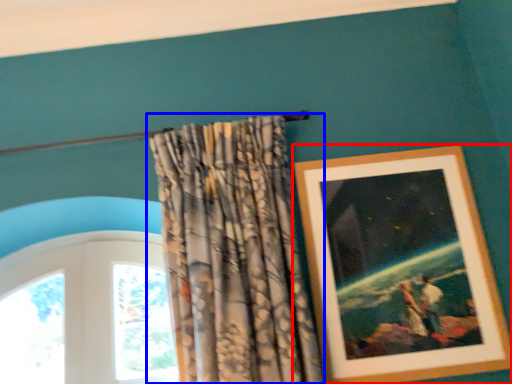
Question: Which of the following is the farthest to the observer, picture frame (highlighted by a red box) or curtain (highlighted by a blue box)?

Choices:
 (A) picture frame
 (B) curtain

Answer: (A)